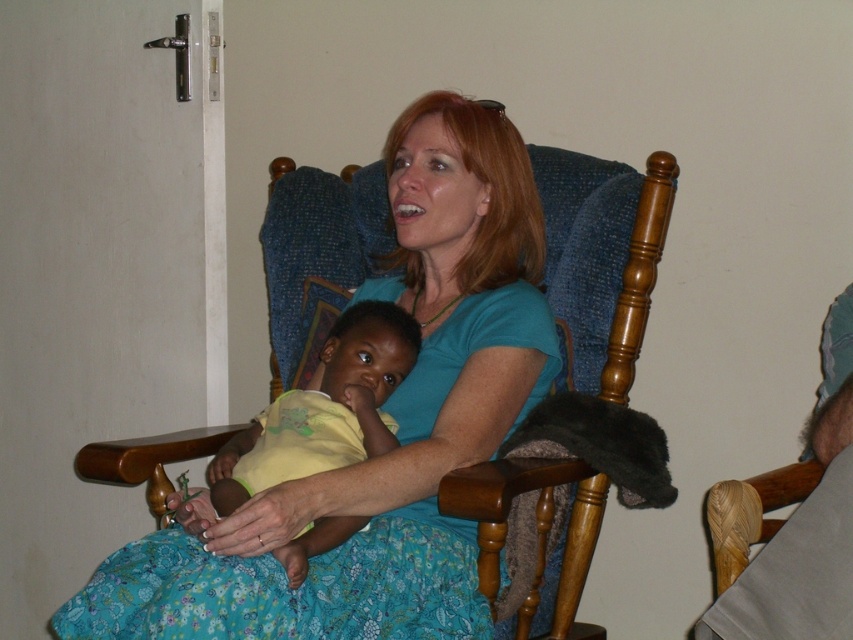
You are a photographer trying to capture a closeup of the yellow matte baby at center without the blue cotton shirt at center blocking the view. Is there a way to adjust your position or angle to achieve this?

The blue cotton shirt at center is positioned over the yellow matte baby at center, so moving your camera slightly downward or to the side might allow you to capture the baby without obstruction.

You are a photographer trying to capture a photo of the blue cotton shirt at center and the yellow matte baby at center. Since you want both subjects to be clearly visible, which one should you focus on first to ensure proper focus?

The blue cotton shirt at center has a greater height compared to the yellow matte baby at center, so you should focus on the blue cotton shirt at center first to ensure proper focus.

You are a photographer trying to capture a candid shot of the blue cotton shirt at center and the yellow matte baby at center. Since you want to ensure both subjects are in focus, you need to know their relative positions. Which object is positioned to the right of the other?

The blue cotton shirt at center is to the right of the yellow matte baby at center.